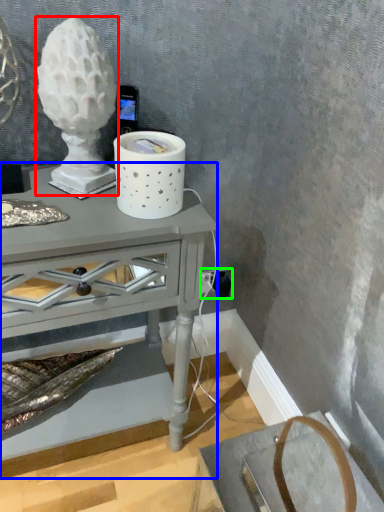
Question: Considering the real-world distances, which object is farthest from candle holder (highlighted by a red box)? table (highlighted by a blue box) or electric outlet (highlighted by a green box)?

Choices:
 (A) table
 (B) electric outlet

Answer: (B)